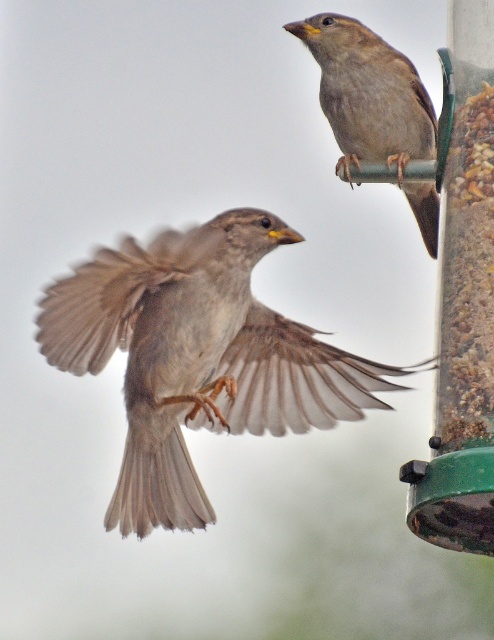
Question: Is brown feathered sparrow at center to the left of brown feathered sparrow at upper right from the viewer's perspective?

Choices:
 (A) no
 (B) yes

Answer: (B)

Question: Which point is farther to the camera?

Choices:
 (A) brown feathered sparrow at center
 (B) brown feathered sparrow at upper right

Answer: (B)

Question: Among these points, which one is farthest from the camera?

Choices:
 (A) (225, 385)
 (B) (399, 81)

Answer: (A)

Question: Which object is closer to the camera taking this photo?

Choices:
 (A) brown feathered sparrow at center
 (B) brown feathered sparrow at upper right

Answer: (A)

Question: In this image, where is brown feathered sparrow at center located relative to brown feathered sparrow at upper right?

Choices:
 (A) above
 (B) below

Answer: (B)

Question: Is the position of brown feathered sparrow at center more distant than that of brown feathered sparrow at upper right?

Choices:
 (A) yes
 (B) no

Answer: (B)